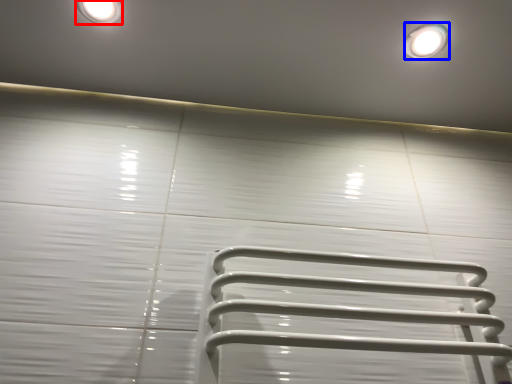
Question: Which point is closer to the camera, lighting (highlighted by a red box) or droplight (highlighted by a blue box)?

Choices:
 (A) lighting
 (B) droplight

Answer: (A)